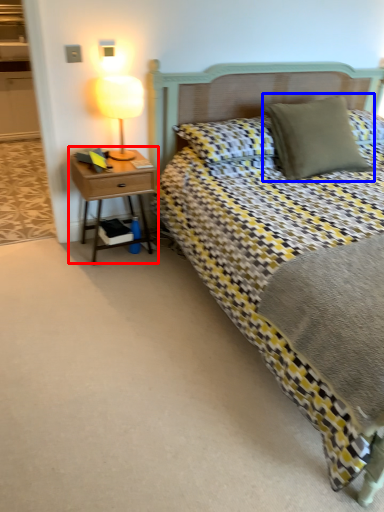
Question: Which point is further to the camera, nightstand (highlighted by a red box) or pillow (highlighted by a blue box)?

Choices:
 (A) nightstand
 (B) pillow

Answer: (A)